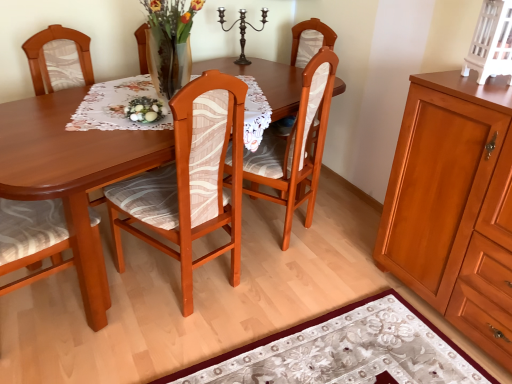
Locate an element on the screen. The image size is (512, 384). free spot in front of white glossy eggs at center is located at coordinates (137, 127).